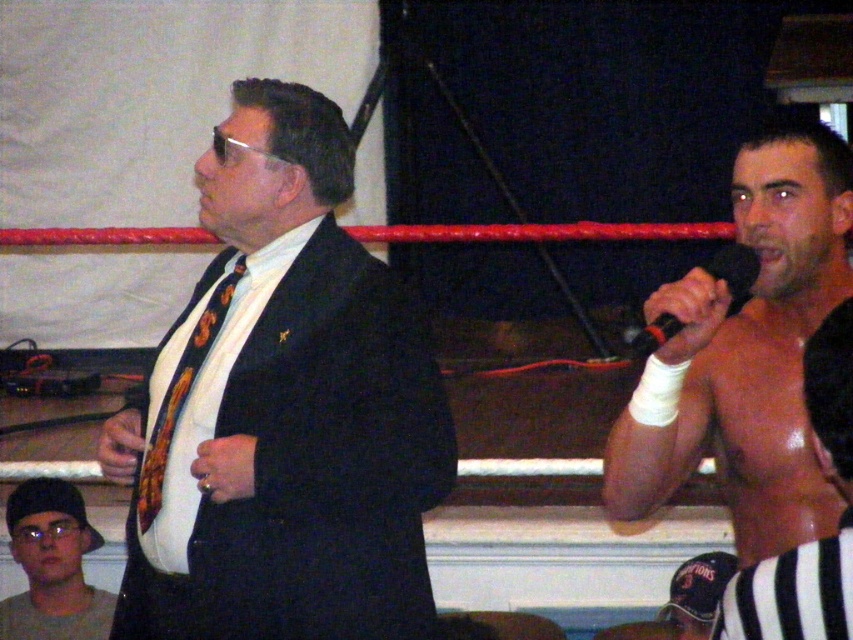
Looking at this image, you are a photographer trying to capture a wide shot of the wrestling event. You need to ensure that both the shiny metallic torso at right and the matte black cap at lower left are fully visible in the frame. Based on their sizes, which object should you prioritize keeping centered to avoid cropping?

The shiny metallic torso at right is narrower than the matte black cap at lower left, so prioritizing the wider matte black cap at lower left in the center would help ensure both fit without cropping.

You are a stagehand who needs to place a new spotlight on the stage. The spotlight must be positioned so that it illuminates both the shiny metallic torso at right and the matte black ring at center without overlapping their lit areas. Given their sizes, which object should the spotlight be aimed at first to ensure both are fully illuminated?

The shiny metallic torso at right is bigger than the matte black ring at center, so the spotlight should be aimed at the shiny metallic torso at right first to cover its larger area before adjusting to include the smaller matte black ring at center.

Based on the photo, you are a photographer positioned at the center of the scene. You want to capture a photo of the shiny metallic torso at right without including the man in the suit. Based on their positions, is this possible?

The shiny metallic torso at right is located at point [815,540], so yes, it is possible to capture a photo of the shiny metallic torso at right without including the man in the suit by adjusting the camera angle or zoom.